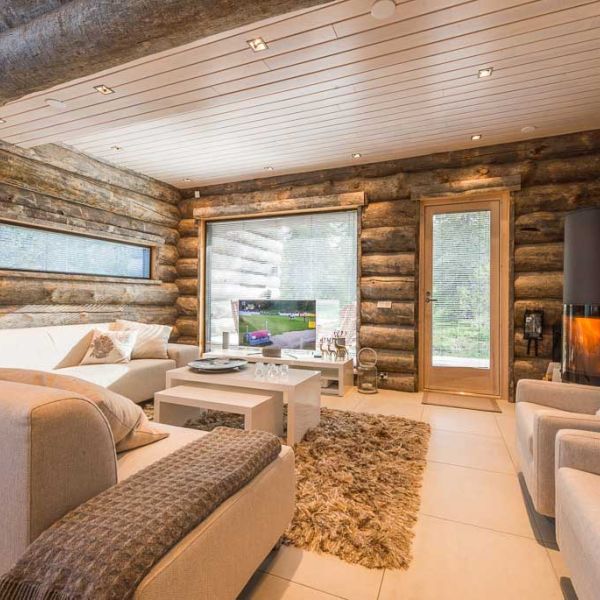
Find the location of a particular element. television is located at coordinates click(x=276, y=332).